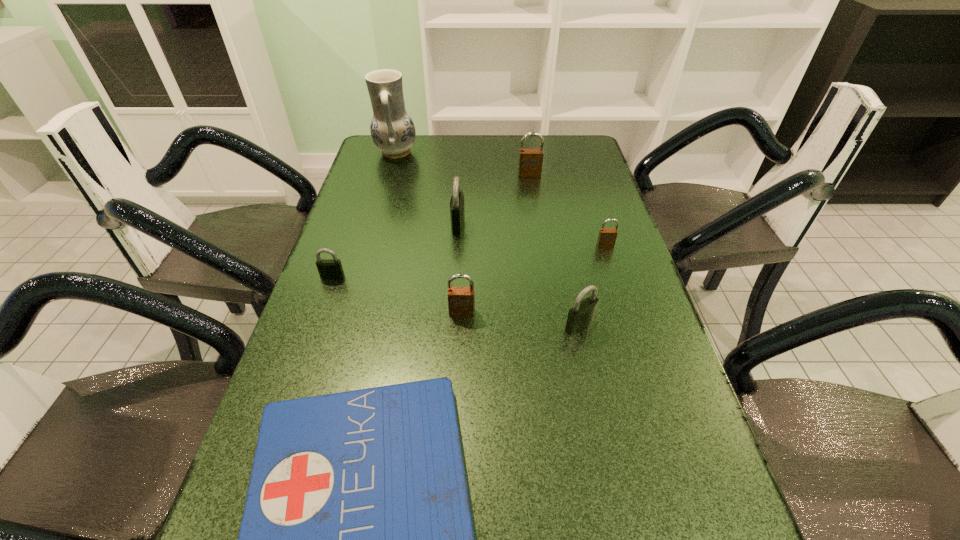
The width and height of the screenshot is (960, 540). I want to click on black padlock that is the closest one to the fifth farthest object, so click(x=457, y=213).

Identify which black padlock is the nearest to the rightmost black padlock. Please provide its 2D coordinates. Your answer should be formatted as a tuple, i.e. [(x, y)], where the tuple contains the x and y coordinates of a point satisfying the conditions above.

[(457, 213)]

Identify which brown padlock is the second closest to the second biggest black padlock. Please provide its 2D coordinates. Your answer should be formatted as a tuple, i.e. [(x, y)], where the tuple contains the x and y coordinates of a point satisfying the conditions above.

[(607, 237)]

Where is `brown padlock identified as the second closest to the tallest object`? The height and width of the screenshot is (540, 960). brown padlock identified as the second closest to the tallest object is located at coordinates (461, 300).